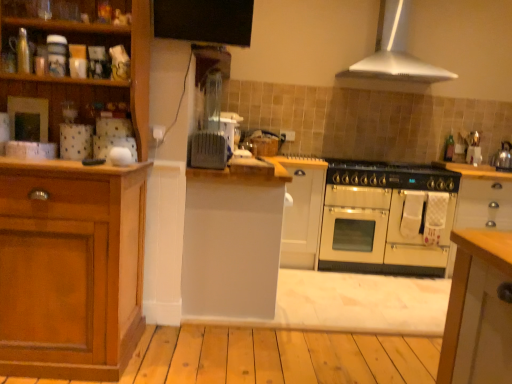
Question: Is satin silver toaster at center, which is the first appliance from back to front, looking in the opposite direction of white matte cabinet at center, which is counted as the 3th cabinetry, starting from the right?

Choices:
 (A) yes
 (B) no

Answer: (B)

Question: From a real-world perspective, is satin silver toaster at center, the 2th appliance from the front, physically above white matte cabinet at center, the second cabinetry positioned from the left?

Choices:
 (A) no
 (B) yes

Answer: (B)

Question: Can you confirm if satin silver toaster at center, the 2th appliance from the front, is shorter than white matte cabinet at center, the second cabinetry positioned from the left?

Choices:
 (A) no
 (B) yes

Answer: (B)

Question: From a real-world perspective, is satin silver toaster at center, the 2th appliance from the front, under white matte cabinet at center, which is counted as the 3th cabinetry, starting from the right?

Choices:
 (A) no
 (B) yes

Answer: (A)

Question: Is satin silver toaster at center, which is the first appliance from back to front, positioned behind white matte cabinet at center, the second cabinetry positioned from the left?

Choices:
 (A) no
 (B) yes

Answer: (B)

Question: Considering the relative positions of satin silver toaster at center, which is the first appliance from back to front, and white matte cabinet at center, which is counted as the 3th cabinetry, starting from the right, in the image provided, is satin silver toaster at center, which is the first appliance from back to front, to the right of white matte cabinet at center, which is counted as the 3th cabinetry, starting from the right, from the viewer's perspective?

Choices:
 (A) yes
 (B) no

Answer: (B)

Question: Is cream matte oven at center not close to white matte cabinet at center, which is counted as the 3th cabinetry, starting from the right?

Choices:
 (A) yes
 (B) no

Answer: (A)

Question: From a real-world perspective, is cream matte oven at center beneath white matte cabinet at center, the second cabinetry positioned from the left?

Choices:
 (A) yes
 (B) no

Answer: (A)

Question: Does cream matte oven at center appear on the right side of white matte cabinet at center, which is counted as the 3th cabinetry, starting from the right?

Choices:
 (A) yes
 (B) no

Answer: (A)

Question: Is white matte cabinet at center, the second cabinetry positioned from the left, completely or partially inside cream matte oven at center?

Choices:
 (A) yes
 (B) no

Answer: (B)

Question: Considering the relative sizes of cream matte oven at center and white matte cabinet at center, which is counted as the 3th cabinetry, starting from the right, in the image provided, is cream matte oven at center taller than white matte cabinet at center, which is counted as the 3th cabinetry, starting from the right,?

Choices:
 (A) yes
 (B) no

Answer: (B)

Question: Is cream matte oven at center looking in the opposite direction of white matte cabinet at center, which is counted as the 3th cabinetry, starting from the right?

Choices:
 (A) no
 (B) yes

Answer: (A)

Question: Does wooden cabinet at left, the first cabinetry viewed from the left, have a lesser height compared to white matte cabinet at center, the third cabinetry positioned from the left?

Choices:
 (A) yes
 (B) no

Answer: (B)